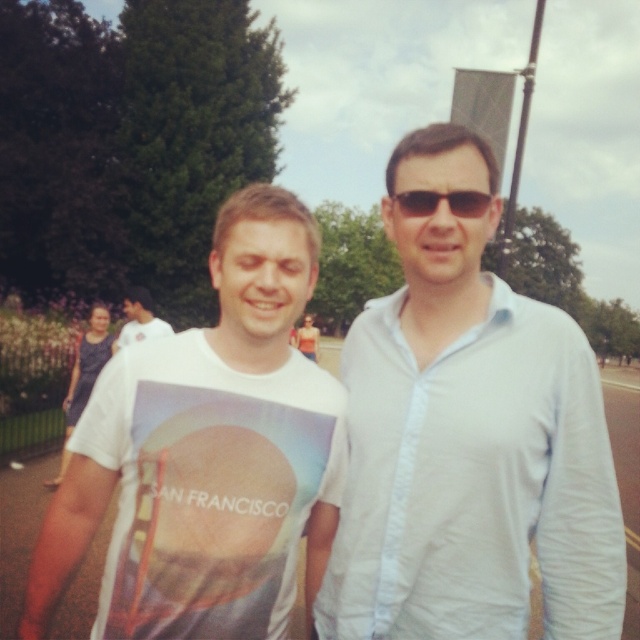
Question: Which point appears closest to the camera in this image?

Choices:
 (A) (522, 492)
 (B) (227, 563)
 (C) (152, 332)
 (D) (410, 212)

Answer: (B)

Question: Does white cotton shirt at center have a smaller size compared to sunglasses at center?

Choices:
 (A) yes
 (B) no

Answer: (B)

Question: Is white cotton shirt at center wider than sunglasses at center?

Choices:
 (A) no
 (B) yes

Answer: (B)

Question: Which point is farther to the camera?

Choices:
 (A) (131, 292)
 (B) (557, 476)
 (C) (241, 627)
 (D) (410, 189)

Answer: (A)

Question: Can you confirm if white cotton t-shirt at center is positioned below white t-shirt at center?

Choices:
 (A) no
 (B) yes

Answer: (B)

Question: Among these objects, which one is nearest to the camera?

Choices:
 (A) white cotton shirt at center
 (B) white cotton t-shirt at center
 (C) sunglasses at center
 (D) white t-shirt at center

Answer: (A)